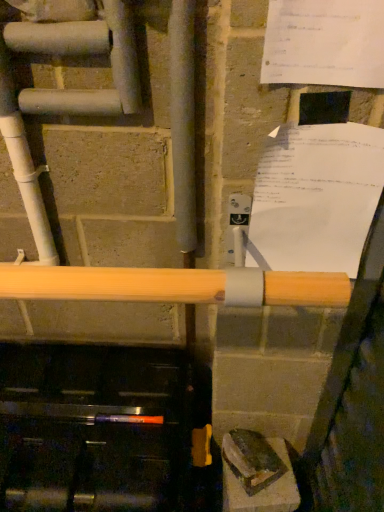
Question: Is white paper at upper right, which ranks as the first paper in top-to-bottom order, a part of white paper at upper right, which is the 2th paper from top to bottom?

Choices:
 (A) no
 (B) yes

Answer: (A)

Question: Is white paper at upper right, positioned as the second paper in front-to-back order, positioned beyond the bounds of white paper at upper right, which ranks as the first paper in top-to-bottom order?

Choices:
 (A) no
 (B) yes

Answer: (B)

Question: Could you tell me if white paper at upper right, which is the 2th paper from top to bottom, is facing white paper at upper right, marked as the 1th paper in a front-to-back arrangement?

Choices:
 (A) no
 (B) yes

Answer: (A)

Question: Is white paper at upper right, positioned as the second paper in front-to-back order, far from white paper at upper right, marked as the 1th paper in a front-to-back arrangement?

Choices:
 (A) yes
 (B) no

Answer: (B)

Question: Is white paper at upper right, positioned as the second paper in front-to-back order, looking in the opposite direction of white paper at upper right, marked as the 1th paper in a front-to-back arrangement?

Choices:
 (A) yes
 (B) no

Answer: (B)

Question: Can you confirm if white paper at upper right, arranged as the first paper when ordered from the bottom, is thinner than white paper at upper right, the 2th paper when ordered from back to front?

Choices:
 (A) no
 (B) yes

Answer: (A)

Question: Considering the relative sizes of white paper at upper right, marked as the 1th paper in a front-to-back arrangement, and white paper at upper right, marked as the 1th paper in a back-to-front arrangement, in the image provided, is white paper at upper right, marked as the 1th paper in a front-to-back arrangement, wider than white paper at upper right, marked as the 1th paper in a back-to-front arrangement,?

Choices:
 (A) yes
 (B) no

Answer: (B)

Question: Can you confirm if white paper at upper right, marked as the 1th paper in a front-to-back arrangement, is smaller than white paper at upper right, which is the 2th paper from top to bottom?

Choices:
 (A) yes
 (B) no

Answer: (A)

Question: From the image's perspective, is white paper at upper right, which ranks as the first paper in top-to-bottom order, above white paper at upper right, which is the 2th paper from top to bottom?

Choices:
 (A) yes
 (B) no

Answer: (A)

Question: Is white paper at upper right, which ranks as the first paper in top-to-bottom order, turned away from white paper at upper right, marked as the 1th paper in a back-to-front arrangement?

Choices:
 (A) yes
 (B) no

Answer: (B)

Question: From a real-world perspective, is white paper at upper right, which ranks as the first paper in top-to-bottom order, on top of white paper at upper right, which is the 2th paper from top to bottom?

Choices:
 (A) yes
 (B) no

Answer: (A)

Question: Considering the relative sizes of white paper at upper right, which ranks as the first paper in top-to-bottom order, and white paper at upper right, positioned as the second paper in front-to-back order, in the image provided, is white paper at upper right, which ranks as the first paper in top-to-bottom order, shorter than white paper at upper right, positioned as the second paper in front-to-back order,?

Choices:
 (A) no
 (B) yes

Answer: (A)

Question: In terms of size, does white paper at upper right, which is the 2th paper from top to bottom, appear bigger or smaller than white paper at upper right, marked as the 1th paper in a front-to-back arrangement?

Choices:
 (A) small
 (B) big

Answer: (B)